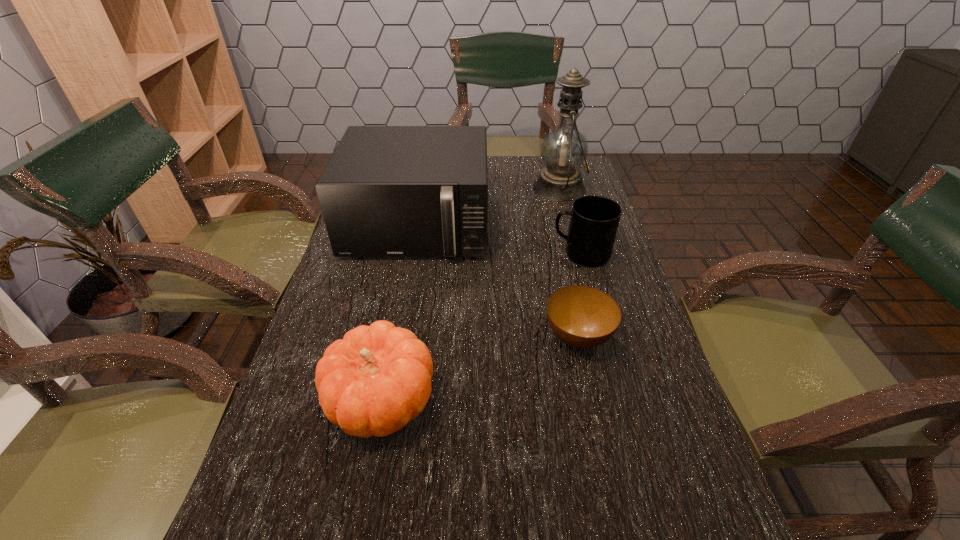
Where is `the fourth closest object to the fourth shortest object`? the fourth closest object to the fourth shortest object is located at coordinates (376, 379).

The image size is (960, 540). I want to click on vacant point that satisfies the following two spatial constraints: 1. on the front-facing side of the bowl; 2. on the left side of the second tallest object, so click(396, 338).

Where is `vacant region that satisfies the following two spatial constraints: 1. on the back side of the shortest object; 2. on the left side of the pumpkin`? vacant region that satisfies the following two spatial constraints: 1. on the back side of the shortest object; 2. on the left side of the pumpkin is located at coordinates (393, 338).